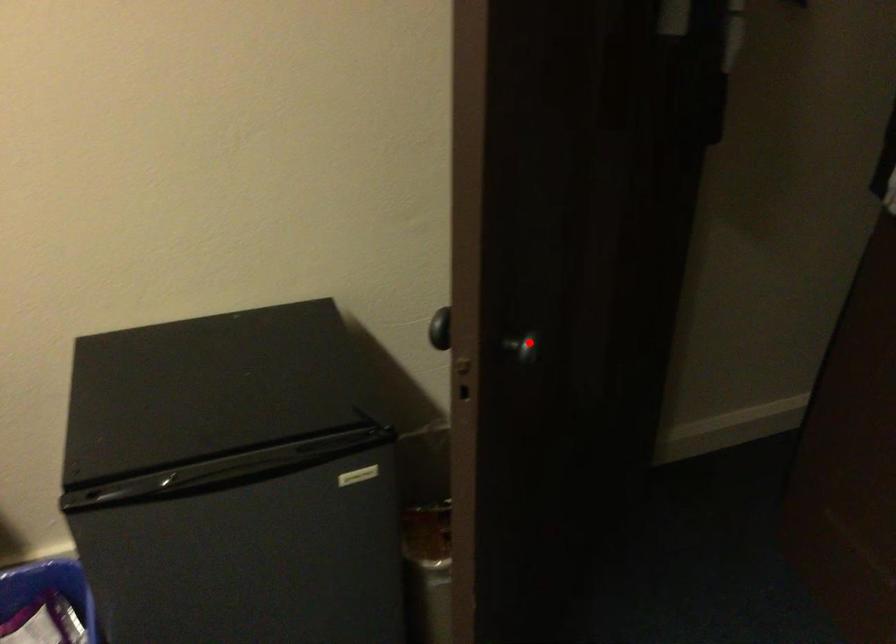
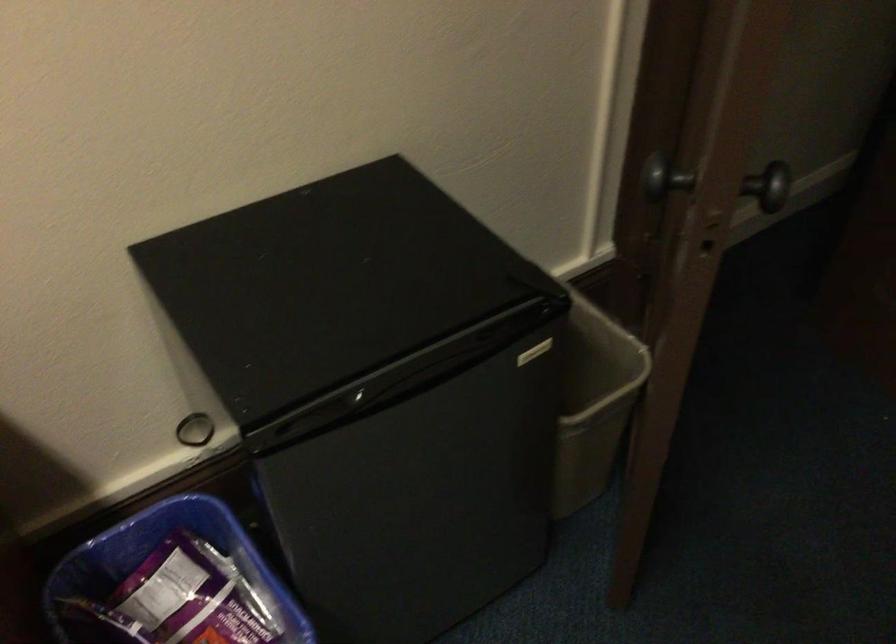
Question: I am providing you with two images of the same scene from different viewpoints. In image1, a red point is highlighted. Considering the same 3D point in image2, which of the following is correct?

Choices:
 (A) It is closer
 (B) It is farther

Answer: (A)